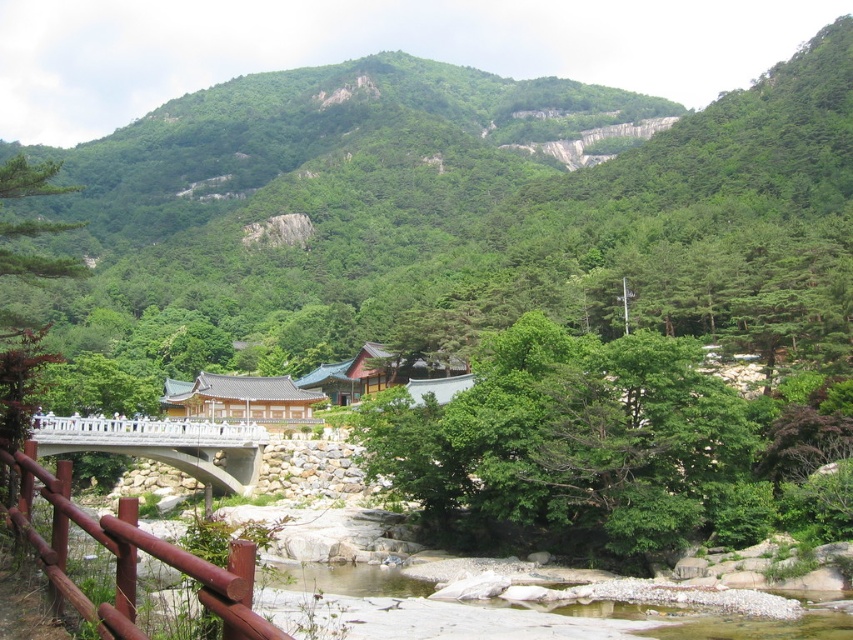
From the picture: You are a hiker standing at the edge of the stream and want to cross to the temple. The brown wooden rail at lower left is on your left side. The white concrete bridge at center is ahead of you. Which path should you take to reach the temple without getting wet?

You should take the path leading to the white concrete bridge at center because the brown wooden rail at lower left is closer to you and marks the edge of the stream, while the bridge spans over the water, allowing you to cross safely to the temple.